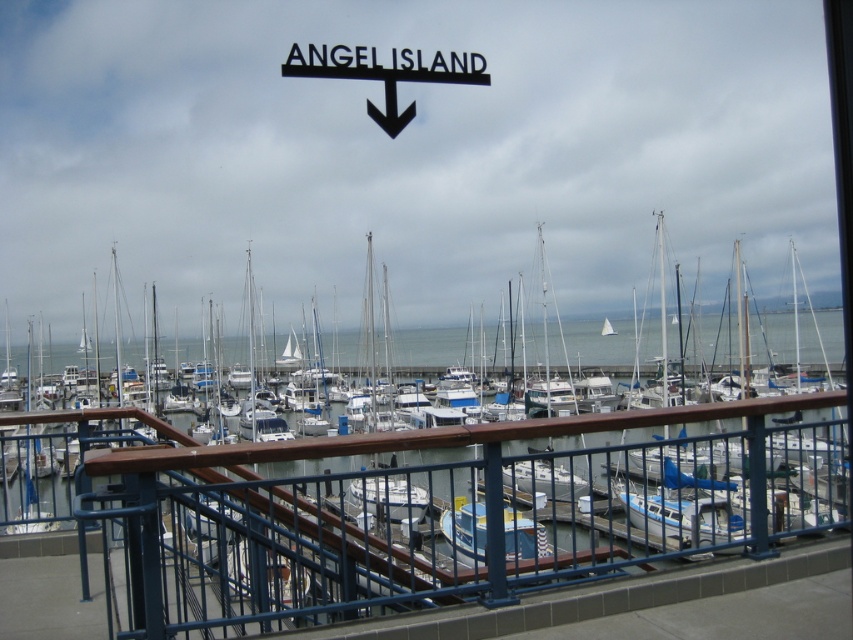
Question: Which object is farther from the camera taking this photo?

Choices:
 (A) black metal sign at upper center
 (B) blue metal railing at center
 (C) white matte sailboat at center

Answer: (A)

Question: Can you confirm if white matte sailboat at center is positioned below blue metal railing at center?

Choices:
 (A) yes
 (B) no

Answer: (A)

Question: Among these objects, which one is nearest to the camera?

Choices:
 (A) black metal sign at upper center
 (B) blue metal railing at center
 (C) white matte sailboat at center

Answer: (C)

Question: Among these objects, which one is nearest to the camera?

Choices:
 (A) black metal sign at upper center
 (B) white matte sailboat at center

Answer: (B)

Question: Is white matte sailboat at center closer to the viewer compared to blue metal railing at center?

Choices:
 (A) yes
 (B) no

Answer: (A)

Question: Where is white matte sailboat at center located in relation to blue metal railing at center in the image?

Choices:
 (A) left
 (B) right

Answer: (A)